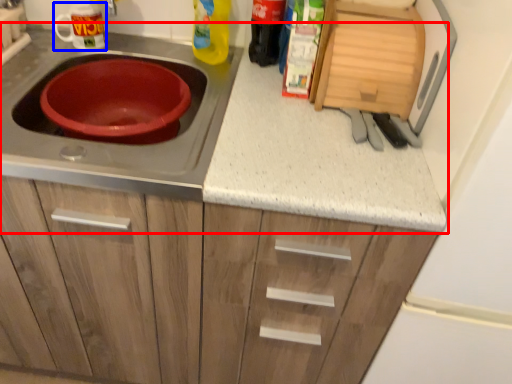
Question: Which point is closer to the camera, countertop (highlighted by a red box) or appliance (highlighted by a blue box)?

Choices:
 (A) countertop
 (B) appliance

Answer: (A)